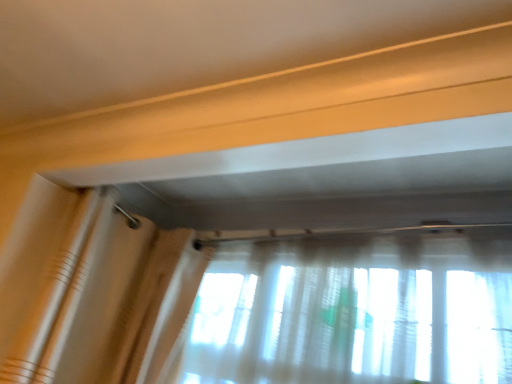
This screenshot has height=384, width=512. Find the location of `white sheer curtain at upper center`. white sheer curtain at upper center is located at coordinates (108, 300).

Measure the distance between point (44,345) and camera.

The depth of point (44,345) is 1.54 meters.

The width and height of the screenshot is (512, 384). What do you see at coordinates (108, 300) in the screenshot?
I see `white sheer curtain at upper center` at bounding box center [108, 300].

In order to click on white sheer curtain at upper center in this screenshot , I will do `click(108, 300)`.